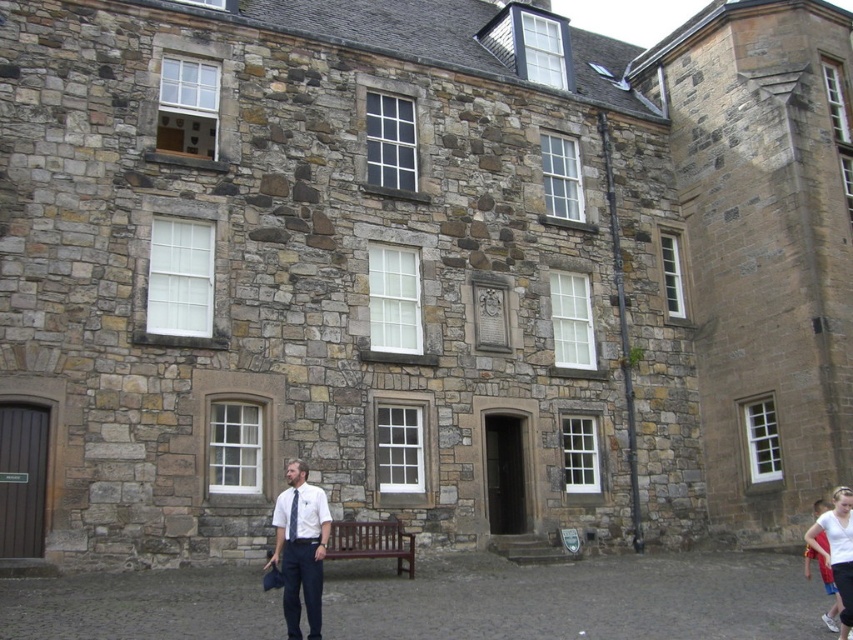
You are standing in front of the historic stone building. There is a point marked at coordinates point (x=299, y=502). Can you determine if this point is closer to you than 25 meters?

The distance of point (x=299, y=502) from camera is 24.19 meters, so yes, the point is closer than 25 meters.

You are standing in front of the historic stone building and notice two points marked on its facade. The first point is at coordinates point (830, 552) and the second is at point (297, 492). Which point is closer to you as you face the building?

Point (830, 552) is in front of point (297, 492), so the first point is closer to you when facing the building.